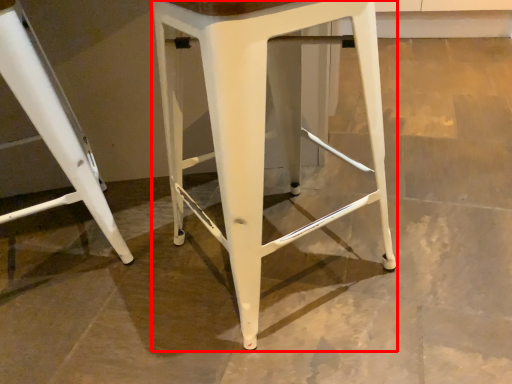
Question: From the image's perspective, where is stool (annotated by the red box) located relative to stool?

Choices:
 (A) below
 (B) above

Answer: (A)